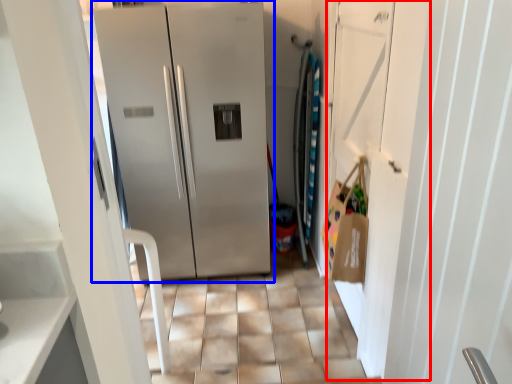
Question: Which object is closer to the camera taking this photo, door (highlighted by a red box) or refrigerator (highlighted by a blue box)?

Choices:
 (A) door
 (B) refrigerator

Answer: (A)